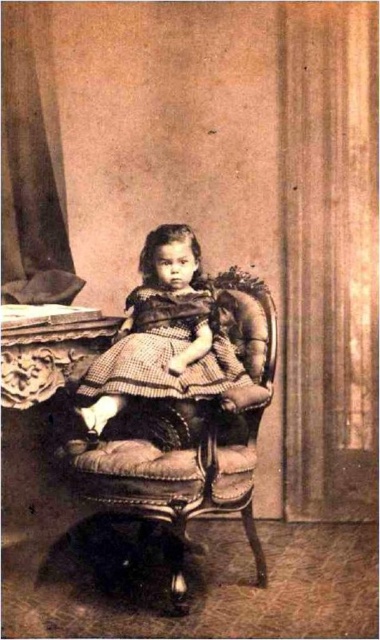
Question: Is velvet upholstered armchair at center positioned before checkered fabric dress at center?

Choices:
 (A) yes
 (B) no

Answer: (A)

Question: Which of the following is the farthest from the observer?

Choices:
 (A) velvet upholstered armchair at center
 (B) checkered fabric dress at center
 (C) matte brown dress at center

Answer: (B)

Question: Does matte brown dress at center have a smaller size compared to checkered fabric dress at center?

Choices:
 (A) yes
 (B) no

Answer: (B)

Question: Does velvet upholstered armchair at center appear over checkered fabric dress at center?

Choices:
 (A) no
 (B) yes

Answer: (A)

Question: Which point is closer to the camera?

Choices:
 (A) matte brown dress at center
 (B) checkered fabric dress at center
 (C) velvet upholstered armchair at center

Answer: (C)

Question: Estimate the real-world distances between objects in this image. Which object is closer to the matte brown dress at center?

Choices:
 (A) checkered fabric dress at center
 (B) velvet upholstered armchair at center

Answer: (A)